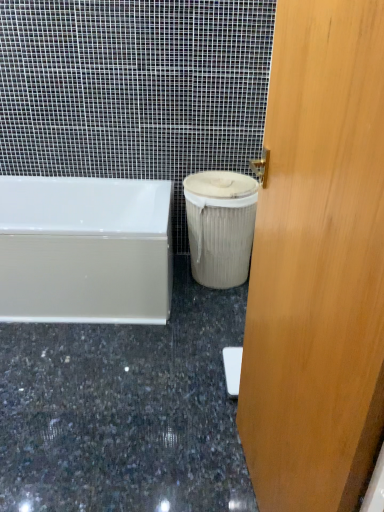
Locate an element on the screen. Image resolution: width=384 pixels, height=512 pixels. beige fabric trash can at lower right is located at coordinates (220, 226).

What do you see at coordinates (85, 250) in the screenshot? This screenshot has width=384, height=512. I see `white glossy bathtub at lower left` at bounding box center [85, 250].

Measure the distance between granite at lower center and camera.

The depth of granite at lower center is 4.32 feet.

Where is `wooden door at center`? wooden door at center is located at coordinates (318, 264).

Which object is positioned more to the left, granite at lower center or wooden door at center?

granite at lower center.

Can we say granite at lower center lies outside wooden door at center?

granite at lower center is positioned outside wooden door at center.

Is granite at lower center thinner than wooden door at center?

No.

From the image's perspective, is beige fabric trash can at lower right located above or below wooden door at center?

beige fabric trash can at lower right is situated higher than wooden door at center in the image.

Based on the photo, in terms of width, does beige fabric trash can at lower right look wider or thinner when compared to wooden door at center?

Clearly, beige fabric trash can at lower right has more width compared to wooden door at center.

Which is correct: beige fabric trash can at lower right is inside wooden door at center, or outside of it?

beige fabric trash can at lower right is not inside wooden door at center, it's outside.

Considering the positions of objects beige fabric trash can at lower right and wooden door at center in the image provided, who is in front, beige fabric trash can at lower right or wooden door at center?

wooden door at center is more forward.

The width and height of the screenshot is (384, 512). Find the location of `granite that appears below the beige fabric trash can at lower right (from a real-world perspective)`. granite that appears below the beige fabric trash can at lower right (from a real-world perspective) is located at coordinates (125, 410).

Measure the distance between granite at lower center and beige fabric trash can at lower right.

granite at lower center is 26.51 inches away from beige fabric trash can at lower right.

Is granite at lower center positioned far away from beige fabric trash can at lower right?

No.

Can you confirm if granite at lower center is taller than beige fabric trash can at lower right?

No, granite at lower center is not taller than beige fabric trash can at lower right.

Is point (233, 238) positioned after point (34, 210)?

No, (233, 238) is closer to viewer.

The width and height of the screenshot is (384, 512). Identify the location of garbage above the white glossy bathtub at lower left (from a real-world perspective). (220, 226).

Is white glossy bathtub at lower left completely or partially inside beige fabric trash can at lower right?

No, white glossy bathtub at lower left is located outside of beige fabric trash can at lower right.

Can you confirm if beige fabric trash can at lower right is wider than white glossy bathtub at lower left?

No, beige fabric trash can at lower right is not wider than white glossy bathtub at lower left.

Is point (332, 460) closer to camera compared to point (190, 241)?

Yes, point (332, 460) is in front of point (190, 241).

Is wooden door at center smaller than beige fabric trash can at lower right?

Actually, wooden door at center might be larger than beige fabric trash can at lower right.

Considering the sizes of objects wooden door at center and beige fabric trash can at lower right in the image provided, who is taller, wooden door at center or beige fabric trash can at lower right?

With more height is wooden door at center.

Is beige fabric trash can at lower right at the back of wooden door at center?

No.

Visually, is wooden door at center positioned to the left or to the right of white glossy bathtub at lower left?

Based on their positions, wooden door at center is located to the right of white glossy bathtub at lower left.

Is point (250, 274) behind point (21, 279)?

That is False.

Is wooden door at center far from white glossy bathtub at lower left?

Absolutely, wooden door at center is distant from white glossy bathtub at lower left.

From the image's perspective, is wooden door at center located above or below white glossy bathtub at lower left?

Based on their image positions, wooden door at center is located beneath white glossy bathtub at lower left.

Can you see white glossy bathtub at lower left touching wooden door at center?

There is a gap between white glossy bathtub at lower left and wooden door at center.

Can we say white glossy bathtub at lower left lies outside wooden door at center?

white glossy bathtub at lower left lies outside wooden door at center's area.

What's the angular difference between white glossy bathtub at lower left and wooden door at center's facing directions?

white glossy bathtub at lower left and wooden door at center are facing 81.3 degrees away from each other.

Who is bigger, white glossy bathtub at lower left or wooden door at center?

With larger size is white glossy bathtub at lower left.

At what (x,y) coordinates should I click in order to perform the action: click on door in front of the granite at lower center. Please return your answer as a coordinate pair (x, y). Looking at the image, I should click on (318, 264).

The height and width of the screenshot is (512, 384). Identify the location of door that is below the beige fabric trash can at lower right (from the image's perspective). (318, 264).

From the image, which object appears to be nearer to beige fabric trash can at lower right, white glossy bathtub at lower left or granite at lower center?

Based on the image, white glossy bathtub at lower left appears to be nearer to beige fabric trash can at lower right.

Estimate the real-world distances between objects in this image. Which object is further from wooden door at center, white glossy bathtub at lower left or granite at lower center?

white glossy bathtub at lower left is further to wooden door at center.

From the image, which object appears to be nearer to white glossy bathtub at lower left, wooden door at center or granite at lower center?

granite at lower center.

Considering their positions, is beige fabric trash can at lower right positioned closer to white glossy bathtub at lower left than granite at lower center?

granite at lower center is closer to white glossy bathtub at lower left.

Looking at the image, which one is located closer to granite at lower center, beige fabric trash can at lower right or white glossy bathtub at lower left?

Based on the image, white glossy bathtub at lower left appears to be nearer to granite at lower center.

Which object lies further to the anchor point granite at lower center, white glossy bathtub at lower left or wooden door at center?

Based on the image, wooden door at center appears to be further to granite at lower center.

From the image, which object appears to be farther from beige fabric trash can at lower right, wooden door at center or white glossy bathtub at lower left?

wooden door at center is further to beige fabric trash can at lower right.

When comparing their distances from white glossy bathtub at lower left, does granite at lower center or beige fabric trash can at lower right seem closer?

granite at lower center is closer to white glossy bathtub at lower left.

The height and width of the screenshot is (512, 384). In order to click on granite between wooden door at center and white glossy bathtub at lower left from front to back in this screenshot , I will do `click(125, 410)`.

Locate an element on the screen. The width and height of the screenshot is (384, 512). bathtub positioned between wooden door at center and beige fabric trash can at lower right from near to far is located at coordinates (85, 250).

Locate an element on the screen. The width and height of the screenshot is (384, 512). granite located between wooden door at center and beige fabric trash can at lower right in the depth direction is located at coordinates (125, 410).

Locate an element on the screen. This screenshot has width=384, height=512. bathtub between granite at lower center and beige fabric trash can at lower right in the front-back direction is located at coordinates (85, 250).